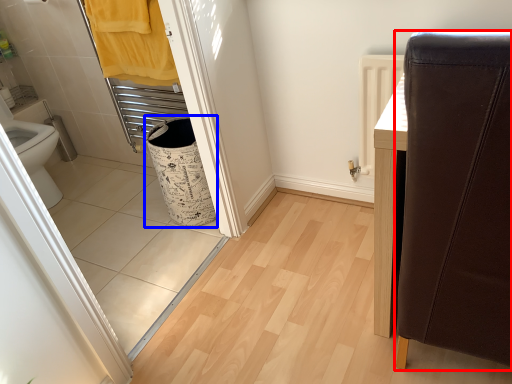
Question: Among these objects, which one is farthest to the camera, furniture (highlighted by a red box) or laundry basket (highlighted by a blue box)?

Choices:
 (A) furniture
 (B) laundry basket

Answer: (B)